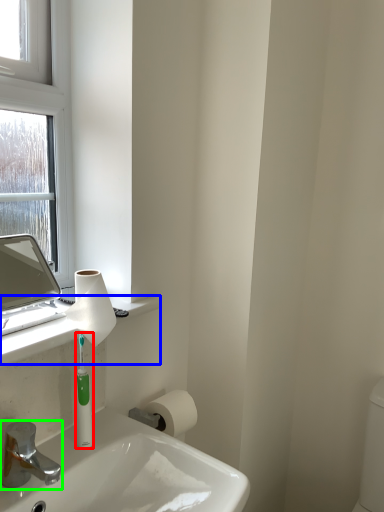
Question: Which is nearer to the mouthwash (highlighted by a red box)? counter top (highlighted by a blue box) or tap (highlighted by a green box).

Choices:
 (A) counter top
 (B) tap

Answer: (A)